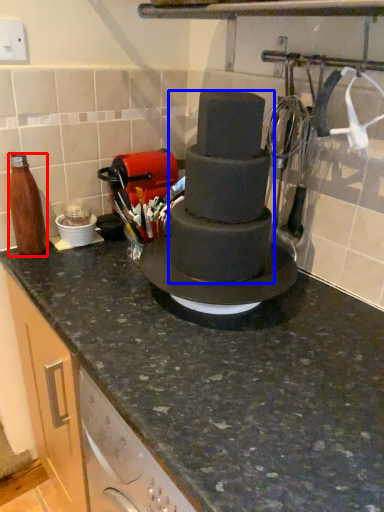
Question: Which point is closer to the camera, bottle (highlighted by a red box) or chocolate cake (highlighted by a blue box)?

Choices:
 (A) bottle
 (B) chocolate cake

Answer: (B)